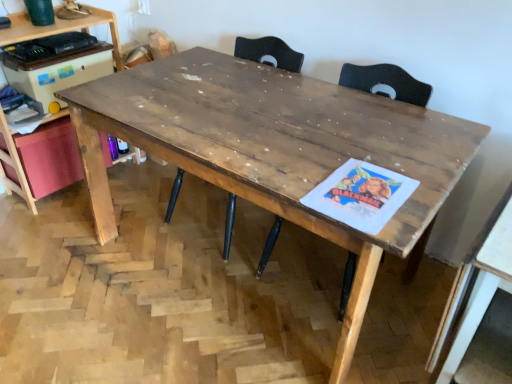
Question: Which direction should I rotate to look at wooden table at center, placed as the 1th table when sorted from left to right, — up or down?

Choices:
 (A) down
 (B) up

Answer: (B)

Question: Considering the relative positions of wooden table at right, which is the second table from left to right, and wooden table at center, placed as the second table when sorted from right to left, in the image provided, is wooden table at right, which is the second table from left to right, to the right of wooden table at center, placed as the second table when sorted from right to left, from the viewer's perspective?

Choices:
 (A) no
 (B) yes

Answer: (B)

Question: Is wooden table at right, which is the second table from left to right, shorter than wooden table at center, placed as the second table when sorted from right to left?

Choices:
 (A) no
 (B) yes

Answer: (B)

Question: Can you confirm if wooden table at right, which is the second table from left to right, is wider than wooden table at center, placed as the 1th table when sorted from left to right?

Choices:
 (A) no
 (B) yes

Answer: (A)

Question: From the image's perspective, does wooden table at right, the 1th table when ordered from right to left, appear higher than wooden table at center, placed as the 1th table when sorted from left to right?

Choices:
 (A) no
 (B) yes

Answer: (A)

Question: Is wooden table at right, which is the second table from left to right, thinner than wooden table at center, placed as the 1th table when sorted from left to right?

Choices:
 (A) yes
 (B) no

Answer: (A)

Question: Is wooden table at right, the 1th table when ordered from right to left, facing away from wooden table at center, placed as the second table when sorted from right to left?

Choices:
 (A) no
 (B) yes

Answer: (A)

Question: Considering the relative positions of wooden table at right, which is the second table from left to right, and wooden swivel chair at center in the image provided, is wooden table at right, which is the second table from left to right, to the right of wooden swivel chair at center from the viewer's perspective?

Choices:
 (A) yes
 (B) no

Answer: (A)

Question: Is wooden table at right, which is the second table from left to right, positioned behind wooden swivel chair at center?

Choices:
 (A) no
 (B) yes

Answer: (A)

Question: Is wooden table at right, which is the second table from left to right, with wooden swivel chair at center?

Choices:
 (A) yes
 (B) no

Answer: (B)

Question: Is wooden table at right, which is the second table from left to right, smaller than wooden swivel chair at center?

Choices:
 (A) yes
 (B) no

Answer: (A)

Question: Can you confirm if wooden table at right, the 1th table when ordered from right to left, is bigger than wooden swivel chair at center?

Choices:
 (A) no
 (B) yes

Answer: (A)

Question: From the image's perspective, is wooden table at right, which is the second table from left to right, above wooden swivel chair at center?

Choices:
 (A) no
 (B) yes

Answer: (A)

Question: Does wooden computer desk at left contain wooden table at right, the 1th table when ordered from right to left?

Choices:
 (A) no
 (B) yes

Answer: (A)